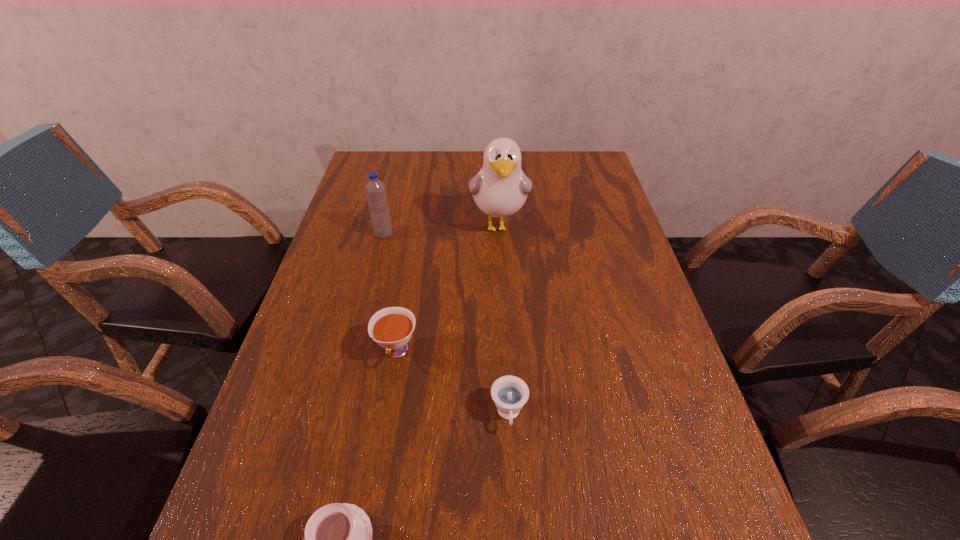
The width and height of the screenshot is (960, 540). In order to click on the tallest object in this screenshot , I will do `click(500, 189)`.

The height and width of the screenshot is (540, 960). I want to click on the second tallest object, so click(375, 190).

Locate an element on the screen. The image size is (960, 540). the tallest teacup is located at coordinates click(392, 327).

Find the location of a particular element. The height and width of the screenshot is (540, 960). the third farthest object is located at coordinates (392, 327).

Identify the location of the fourth farthest object. (509, 393).

Locate an element on the screen. The height and width of the screenshot is (540, 960). the second nearest teacup is located at coordinates (509, 393).

The height and width of the screenshot is (540, 960). Find the location of `vacant area located 0.150m on the beak of the tallest object`. vacant area located 0.150m on the beak of the tallest object is located at coordinates (502, 288).

Locate an element on the screen. This screenshot has height=540, width=960. blank space located on the front of the second tallest object is located at coordinates (356, 343).

The width and height of the screenshot is (960, 540). I want to click on vacant position located on the side of the third tallest object with the handle, so click(x=382, y=436).

This screenshot has height=540, width=960. Find the location of `free space located 0.080m on the side of the second farthest teacup with the handle`. free space located 0.080m on the side of the second farthest teacup with the handle is located at coordinates (513, 481).